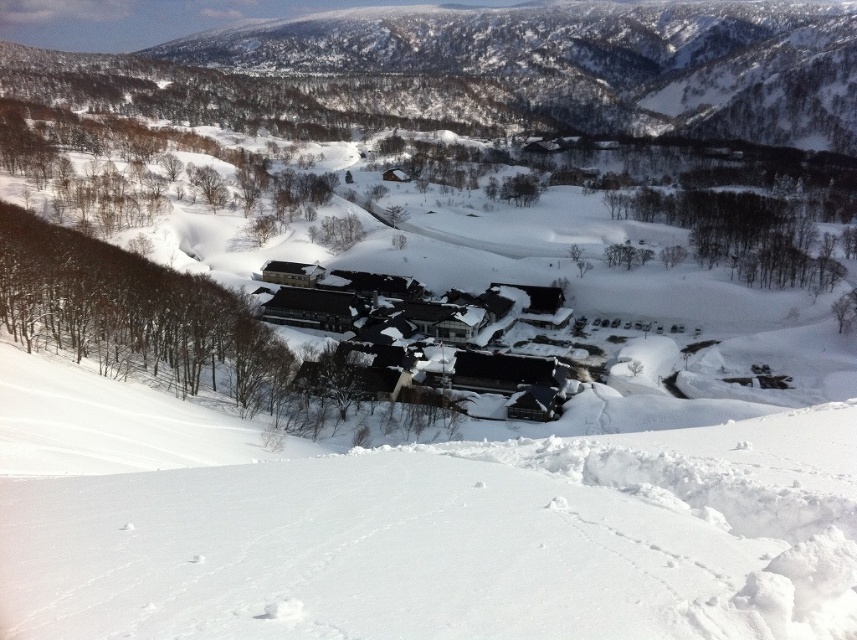
You are planning to build a snowman in the winter landscape. The white snow at lower center is your only source of snow. Can you use it to cover the top of the black shingled roofs at center?

The white snow at lower center is shorter than the black shingled roofs at center, so you cannot reach the top of the black shingled roofs at center with the snow from the white snow at lower center.

You are standing at the point marked as point (542, 410) and want to walk to the point marked as point (842, 422). According to the scene, which direction should you move to reach your destination?

You should move towards the camera because point (842, 422) is closer to the camera than point (542, 410).